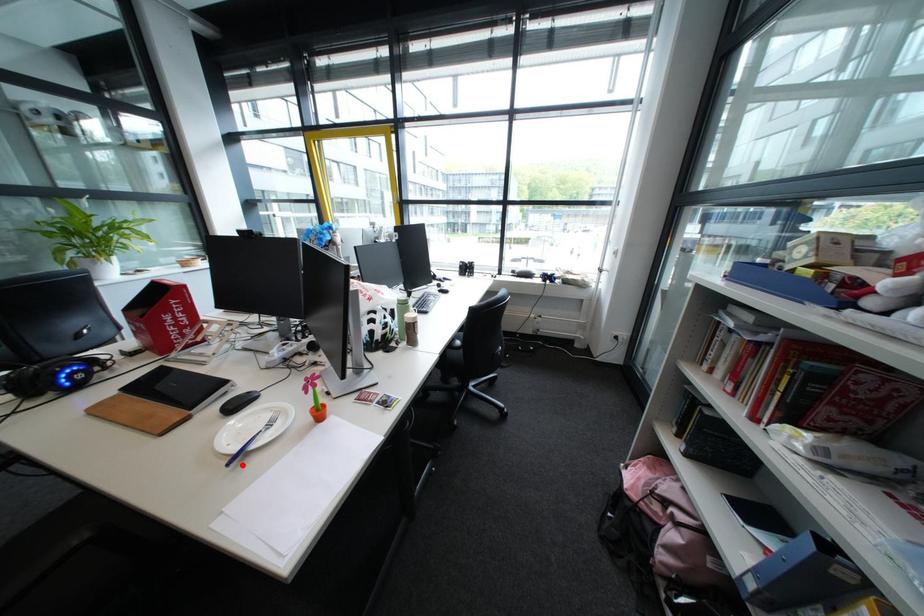
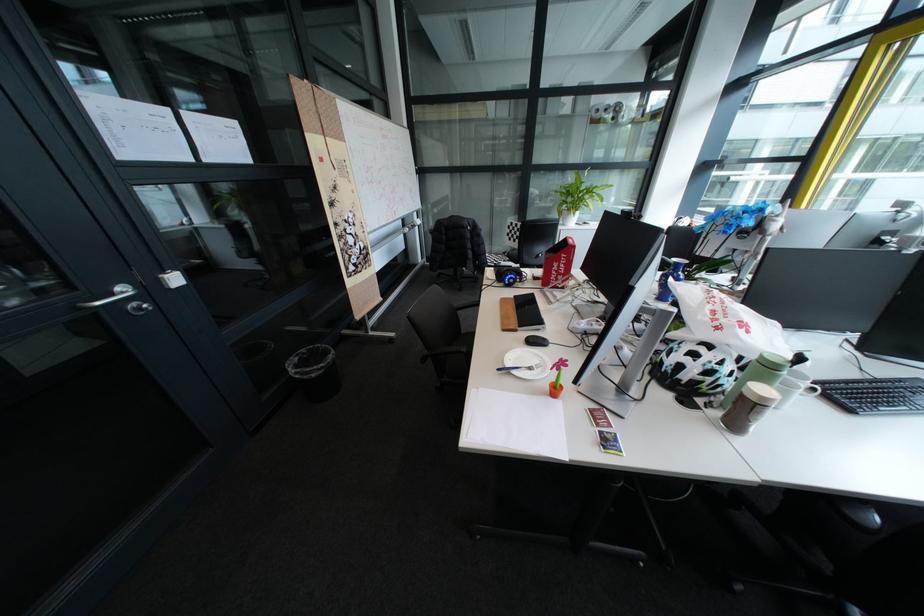
Question: I am providing you with two images of the same scene from different viewpoints. A red point is marked on the first image. Can you still see the location of the red point in image 2?

Choices:
 (A) Yes
 (B) No

Answer: (A)